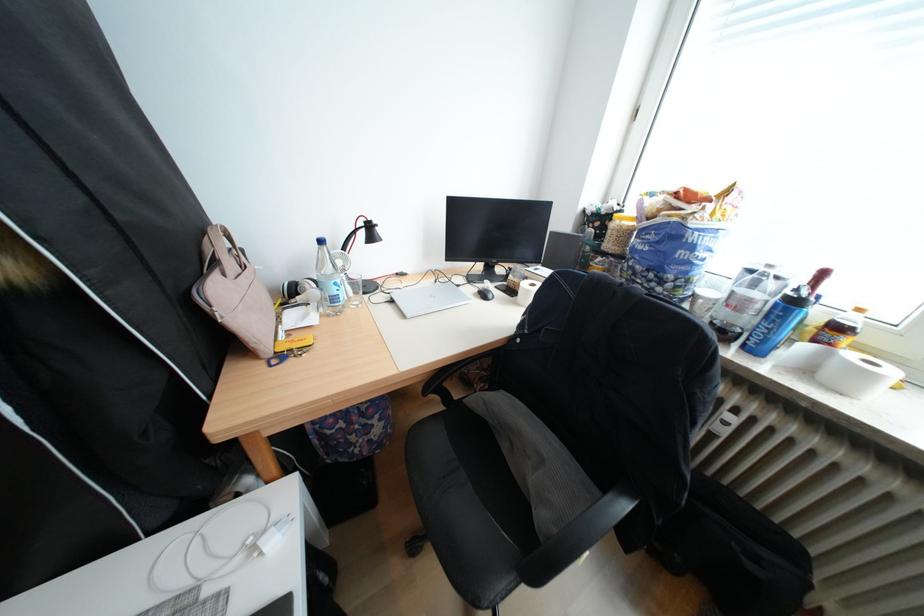
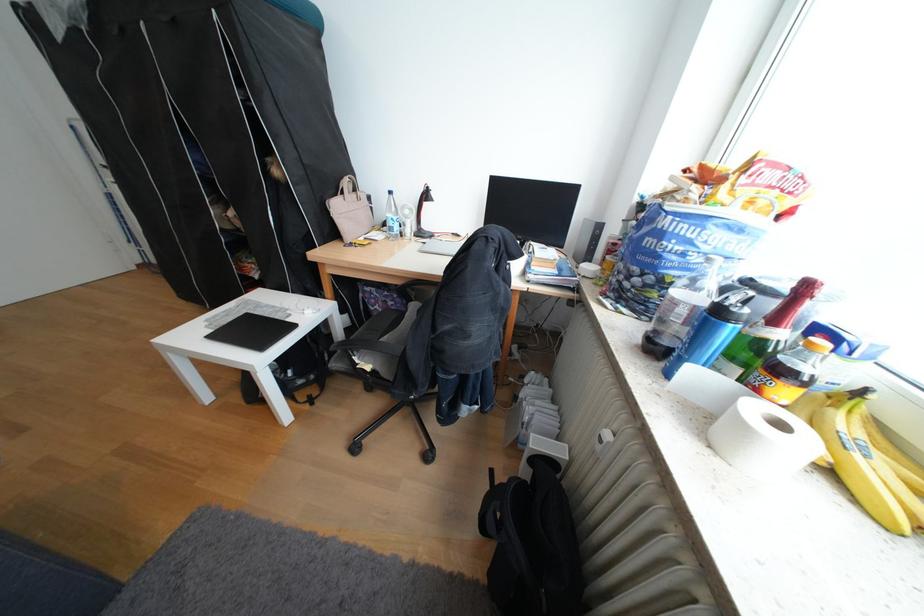
Where in the second image is the point corresponding to point (772, 307) from the first image?

(695, 312)